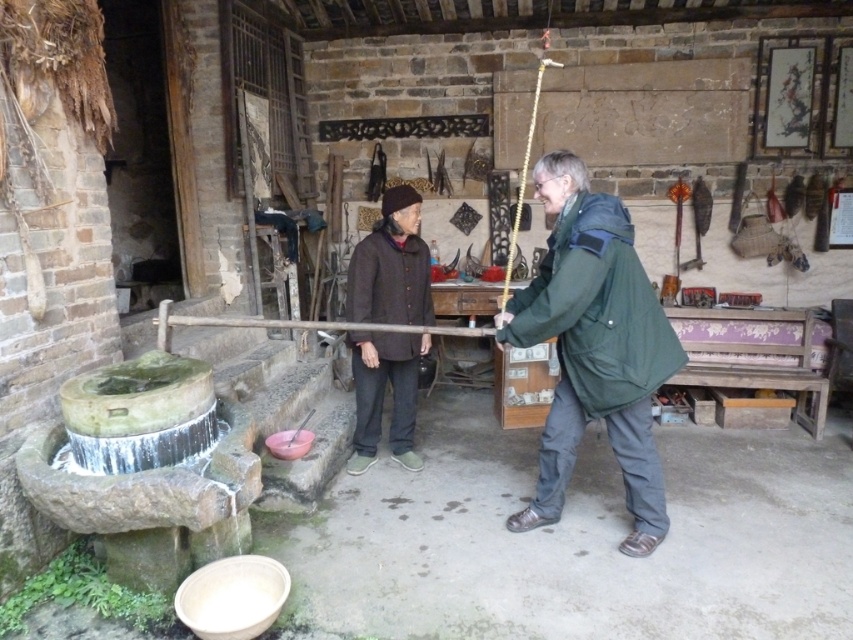
Does green matte jacket at center have a smaller size compared to brown woolen sweater at center?

Actually, green matte jacket at center might be larger than brown woolen sweater at center.

In the scene shown: Is green matte jacket at center above brown woolen sweater at center?

Actually, green matte jacket at center is below brown woolen sweater at center.

Measure the distance between point [538,333] and camera.

They are 9.13 feet apart.

In order to click on green matte jacket at center in this screenshot , I will do `click(593, 348)`.